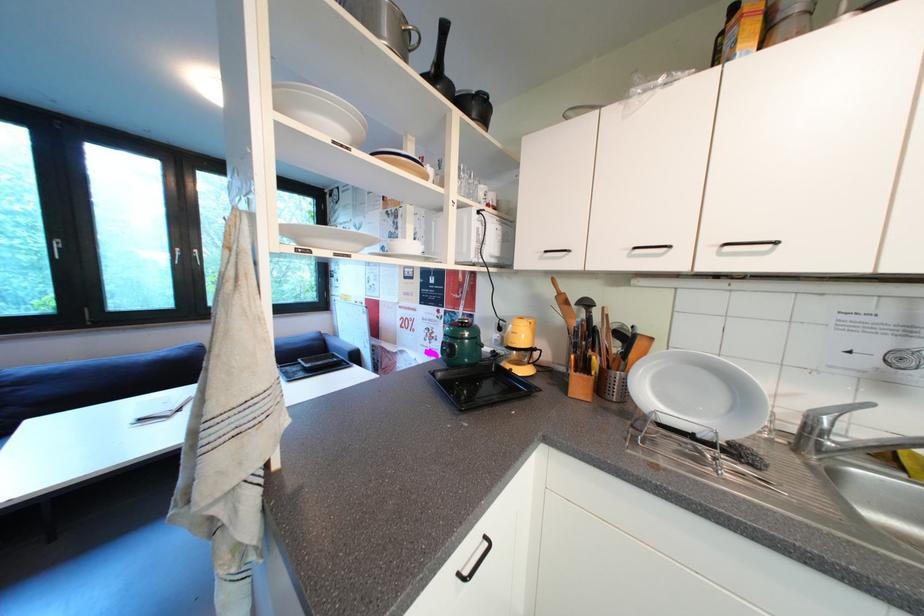
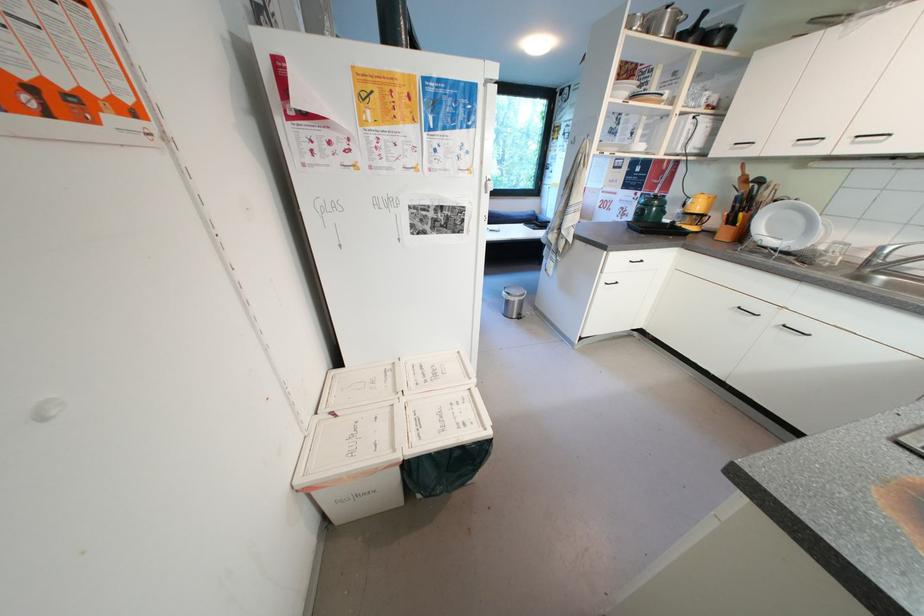
Where in the second image is the point corresponding to (450,313) from the first image?

(647, 196)